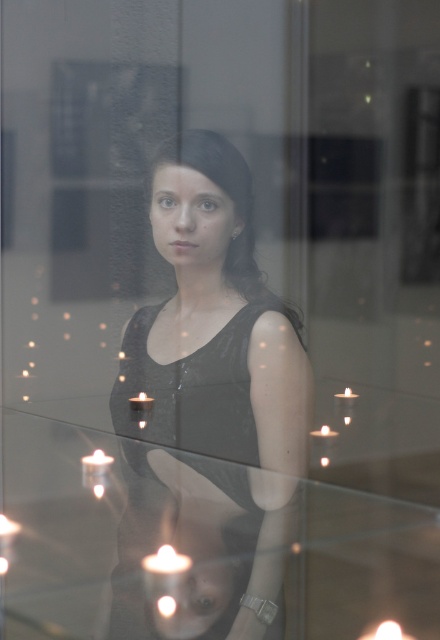
Question: Is matte black dress at center to the left of matte white candle at center from the viewer's perspective?

Choices:
 (A) yes
 (B) no

Answer: (B)

Question: Considering the real-world distances, which object is closest to the matte black dress at center?

Choices:
 (A) black velvet dress at center
 (B) matte white candle at center

Answer: (A)

Question: Among these points, which one is farthest from the camera?

Choices:
 (A) (333, 394)
 (B) (234, 321)
 (C) (150, 557)

Answer: (A)

Question: Which point is closer to the camera?

Choices:
 (A) white wax candle at lower center
 (B) matte white candle at center

Answer: (A)

Question: Is matte black dress at center bigger than matte white candle at center?

Choices:
 (A) yes
 (B) no

Answer: (A)

Question: Considering the relative positions of matte white candle at center and white wax candle at upper right in the image provided, where is matte white candle at center located with respect to white wax candle at upper right?

Choices:
 (A) left
 (B) right

Answer: (A)